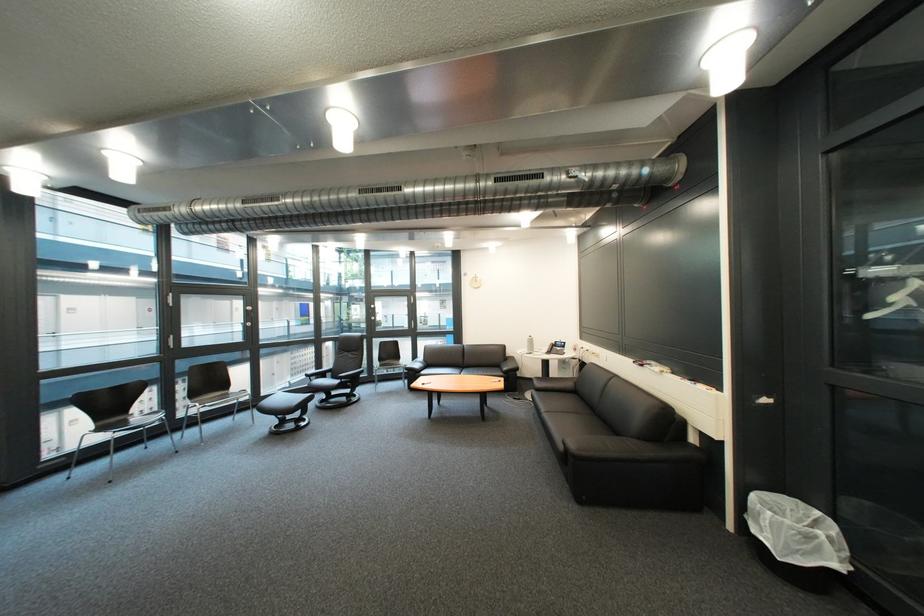
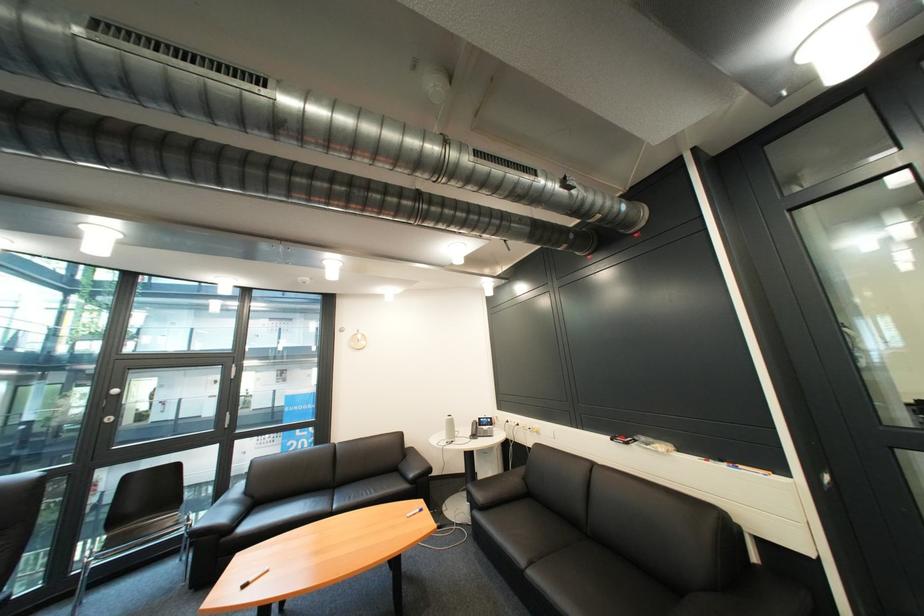
In the second image, find the point that corresponds to point 439,365 in the first image.

(262, 503)